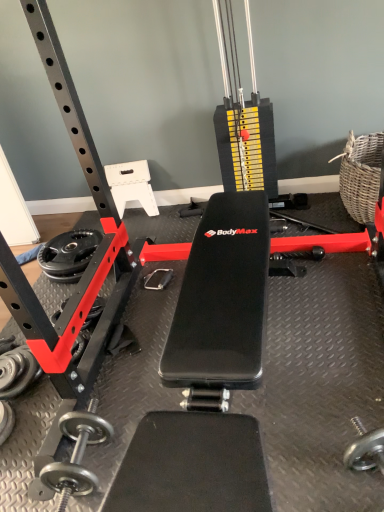
Image resolution: width=384 pixels, height=512 pixels. I want to click on space that is in front of black rubber dumbbell at lower left, acting as the 1th dumbbell starting from the top, so click(x=26, y=417).